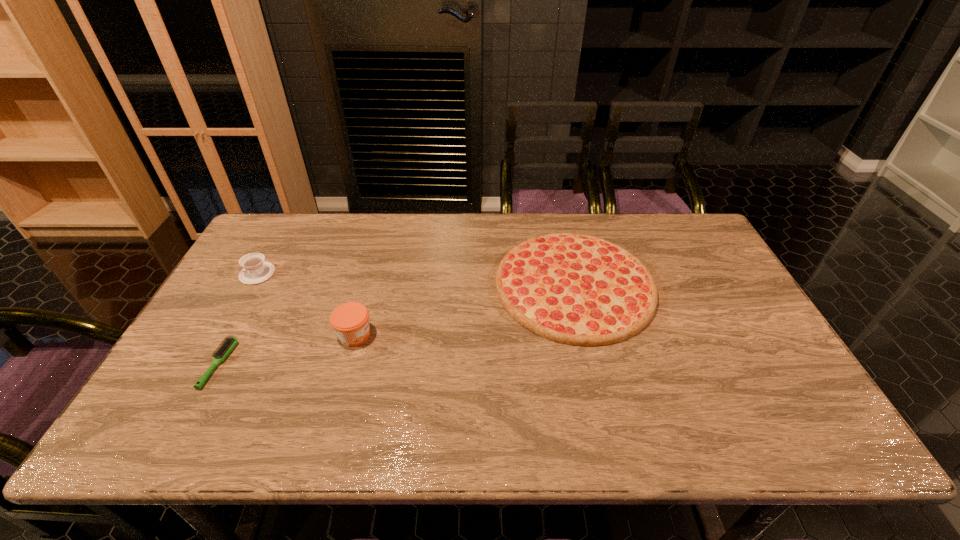
The image size is (960, 540). I want to click on jam, so click(x=350, y=321).

At what (x,y) coordinates should I click in order to perform the action: click on the tallest object. Please return your answer as a coordinate pair (x, y). Looking at the image, I should click on (350, 321).

Where is `teacup`? The width and height of the screenshot is (960, 540). teacup is located at coordinates (255, 270).

Where is `pizza`? This screenshot has width=960, height=540. pizza is located at coordinates (576, 289).

At what (x,y) coordinates should I click in order to perform the action: click on hairbrush. Please return your answer as a coordinate pair (x, y). This screenshot has width=960, height=540. Looking at the image, I should click on (223, 351).

The image size is (960, 540). What are the coordinates of `free space located 0.270m on the front label of the jam` in the screenshot? It's located at (474, 335).

The image size is (960, 540). I want to click on free region located 0.090m on the right of the pizza, so click(x=684, y=285).

At what (x,y) coordinates should I click in order to perform the action: click on free location located on the front of the hairbrush. Please return your answer as a coordinate pair (x, y). This screenshot has height=540, width=960. Looking at the image, I should click on (184, 429).

Find the location of a particular element. Image resolution: width=960 pixels, height=540 pixels. object located at the far edge is located at coordinates (576, 289).

The width and height of the screenshot is (960, 540). I want to click on teacup located at the left edge, so (255, 270).